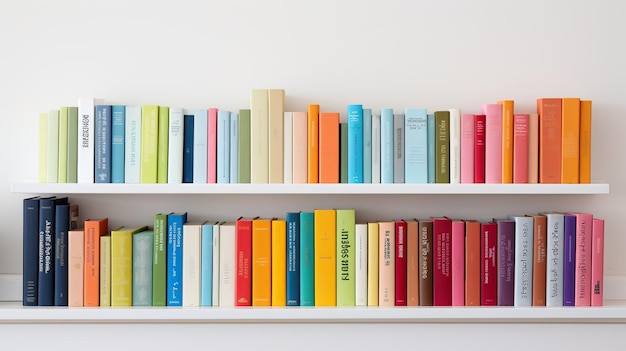
Where is `brown books`? This screenshot has height=351, width=626. brown books is located at coordinates (423, 254), (414, 256), (538, 248), (471, 263).